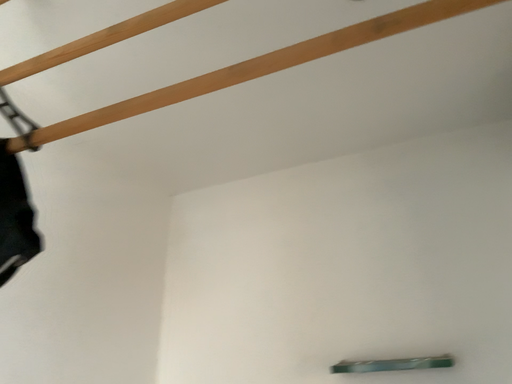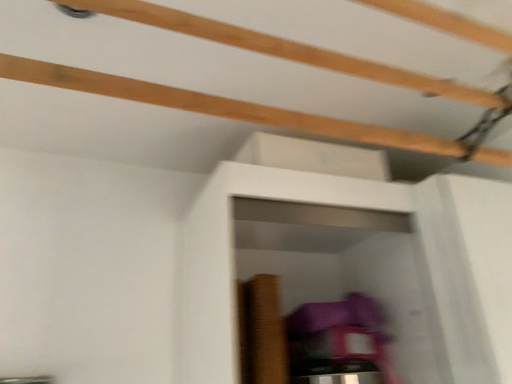
Question: Which way did the camera rotate in the video?

Choices:
 (A) rotated right
 (B) rotated left

Answer: (A)